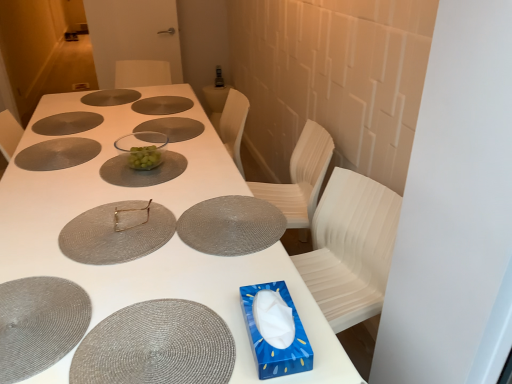
Identify the location of empty space that is in between blue paper tissue box at lower right and transparent glass bowl at center. The height and width of the screenshot is (384, 512). (189, 222).